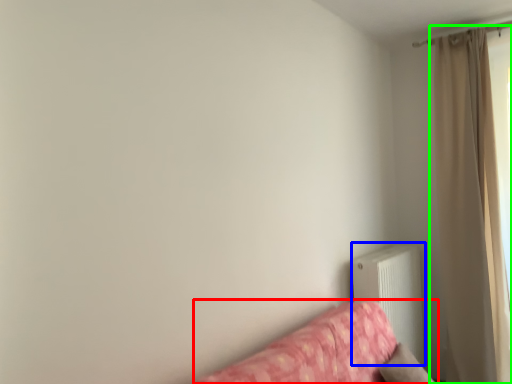
Question: Which object is positioned closest to studio couch (highlighted by a red box)? Select from radiator (highlighted by a blue box) and curtain (highlighted by a green box).

Choices:
 (A) radiator
 (B) curtain

Answer: (A)